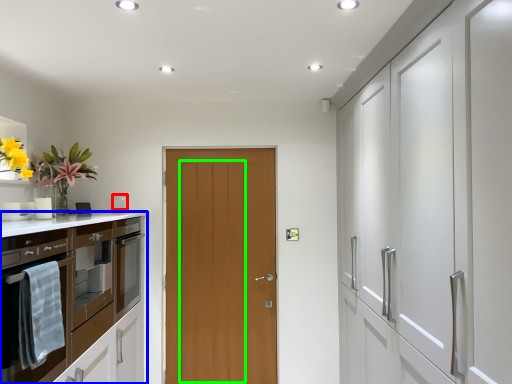
Question: Based on their relative distances, which object is farther from appliance (highlighted by a red box)? Choose from cabinetry (highlighted by a blue box) and door (highlighted by a green box).

Choices:
 (A) cabinetry
 (B) door

Answer: (A)